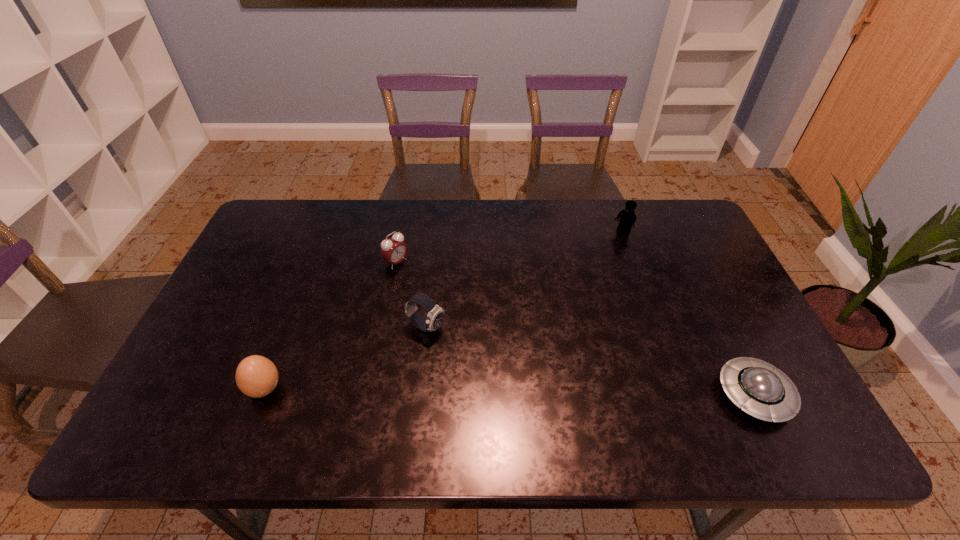
Find the location of a particular element. vacant space that is in between the fourth nearest object and the watch is located at coordinates (411, 295).

You are a GUI agent. You are given a task and a screenshot of the screen. Output one action in this format:
    pyautogui.click(x=<x>, y=<y>)
    Task: Click on the fourth closest object to the second object from right to left
    The height and width of the screenshot is (540, 960).
    Given the screenshot: What is the action you would take?
    pyautogui.click(x=256, y=376)

The width and height of the screenshot is (960, 540). Find the location of `the fourth closest object relative to the third farthest object`. the fourth closest object relative to the third farthest object is located at coordinates (762, 391).

Where is `vacant space that satisfies the following two spatial constraints: 1. on the back side of the fourth object from right to left; 2. on the left side of the leftmost object`? The height and width of the screenshot is (540, 960). vacant space that satisfies the following two spatial constraints: 1. on the back side of the fourth object from right to left; 2. on the left side of the leftmost object is located at coordinates (314, 262).

Where is `free space in the image that satisfies the following two spatial constraints: 1. on the back side of the fourth object from right to left; 2. on the left side of the leftmost object`? free space in the image that satisfies the following two spatial constraints: 1. on the back side of the fourth object from right to left; 2. on the left side of the leftmost object is located at coordinates (314, 262).

Find the location of a particular element. vacant area that satisfies the following two spatial constraints: 1. on the back side of the leftmost object; 2. on the right side of the alarm clock is located at coordinates (314, 262).